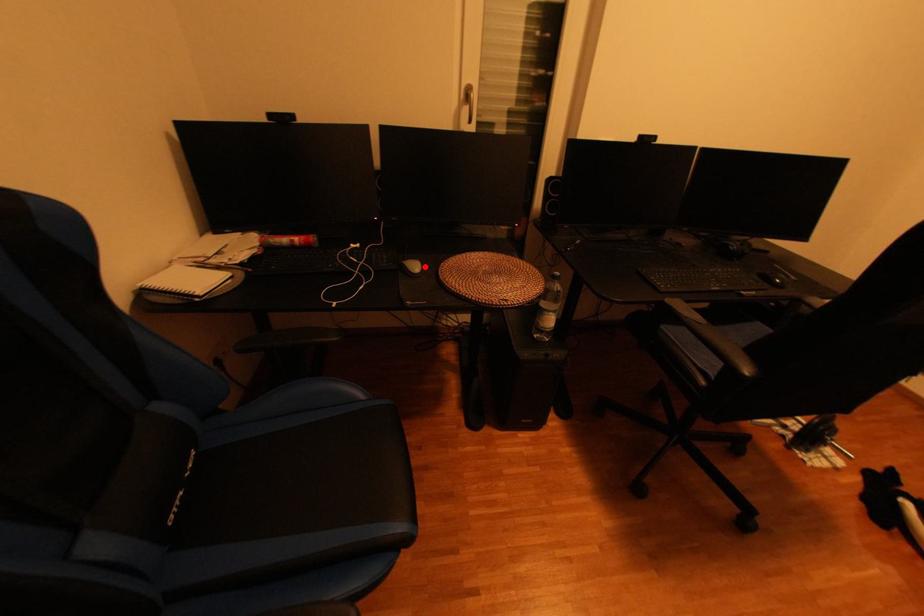
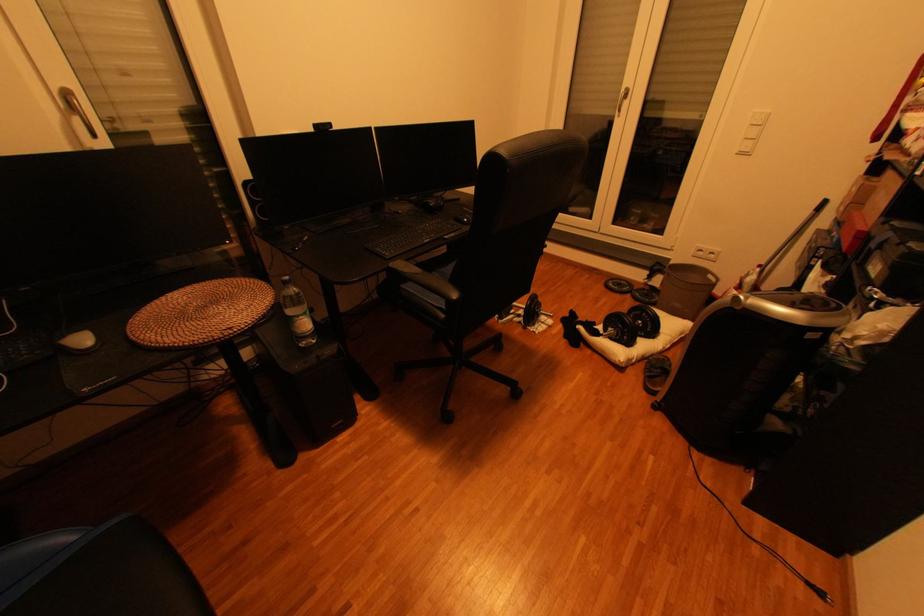
The point at the highlighted location is marked in the first image. Where is the corresponding point in the second image?

(92, 341)